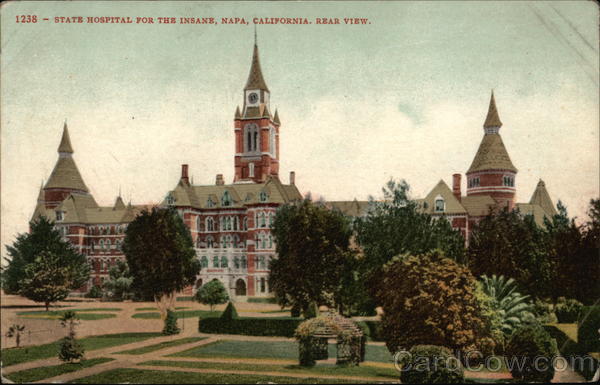
Where is `clock`? This screenshot has height=385, width=600. clock is located at coordinates (253, 101).